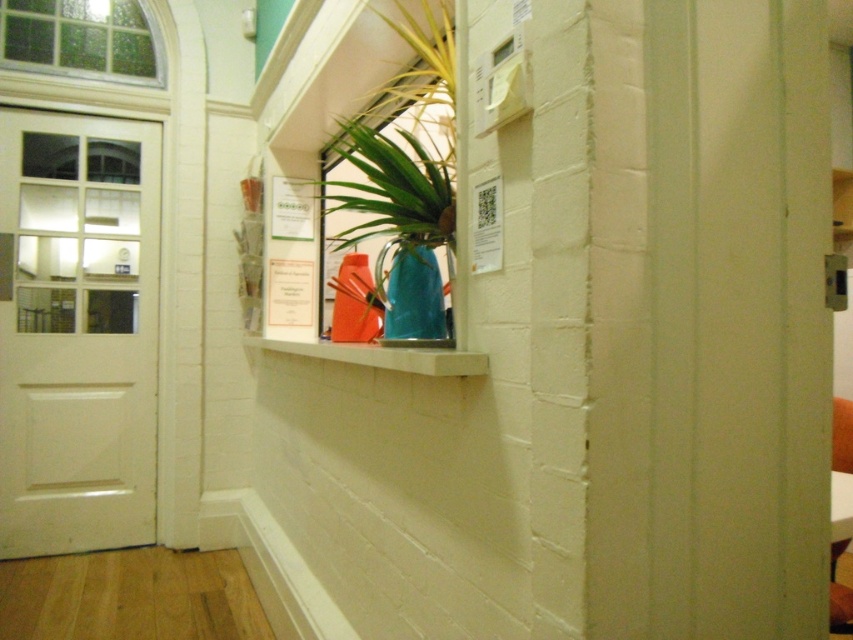
Question: Among these objects, which one is farthest from the camera?

Choices:
 (A) matte blue vase at center
 (B) white glossy door at left
 (C) blue glass vase at center
 (D) white concrete shelf at center

Answer: (B)

Question: Is white glossy door at left wider than stained glass window at upper left?

Choices:
 (A) no
 (B) yes

Answer: (A)

Question: Which object is closer to the camera taking this photo?

Choices:
 (A) white glossy door at left
 (B) matte blue vase at center
 (C) white concrete shelf at center

Answer: (C)

Question: From the image, what is the correct spatial relationship of stained glass window at upper left in relation to white concrete shelf at center?

Choices:
 (A) below
 (B) above

Answer: (B)

Question: Is white glossy door at left in front of white concrete shelf at center?

Choices:
 (A) yes
 (B) no

Answer: (B)

Question: Which of the following is the farthest from the observer?

Choices:
 (A) blue glass vase at center
 (B) white glossy door at left
 (C) matte blue vase at center

Answer: (B)